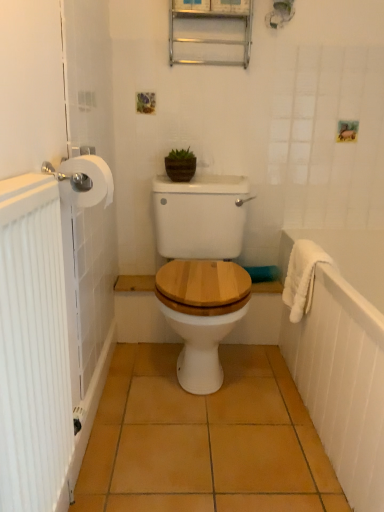
What do you see at coordinates (180, 165) in the screenshot? The image size is (384, 512). I see `green matte pot at center` at bounding box center [180, 165].

The image size is (384, 512). What do you see at coordinates (33, 347) in the screenshot?
I see `white ribbed radiator at left` at bounding box center [33, 347].

Describe the element at coordinates (302, 277) in the screenshot. I see `white fluffy bath towel at right` at that location.

In order to face white matte toilet paper at left, should I rotate leftwards or rightwards?

Turn left approximately 14.302 degrees to face it.

What are the coordinates of `orange ceramic tile at center` in the screenshot? It's located at click(204, 439).

In order to click on metallic silver medicine cabinet at upper center in this screenshot , I will do pyautogui.click(x=211, y=19).

From the image's perspective, would you say white fluffy bath towel at right is positioned over green matte pot at center?

No, from the image's perspective, white fluffy bath towel at right is not over green matte pot at center.

Does white fluffy bath towel at right have a greater height compared to green matte pot at center?

Yes.

Considering the relative positions of white fluffy bath towel at right and green matte pot at center in the image provided, is white fluffy bath towel at right to the right of green matte pot at center from the viewer's perspective?

Indeed, white fluffy bath towel at right is positioned on the right side of green matte pot at center.

How different are the orientations of white fluffy bath towel at right and green matte pot at center in degrees?

They differ by 87.3 degrees in their facing directions.

Which object is closer to the camera taking this photo, white matte toilet paper at left or orange ceramic tile at center?

white matte toilet paper at left.

From the picture: From a real-world perspective, is white matte toilet paper at left located beneath orange ceramic tile at center?

No, from a real-world perspective, white matte toilet paper at left is not under orange ceramic tile at center.

Measure the distance from white matte toilet paper at left to orange ceramic tile at center.

They are 35.41 inches apart.

Are white matte toilet paper at left and orange ceramic tile at center beside each other?

No, white matte toilet paper at left is not making contact with orange ceramic tile at center.

Considering the relative positions of white fluffy bath towel at right and white ribbed radiator at left in the image provided, is white fluffy bath towel at right to the left of white ribbed radiator at left from the viewer's perspective?

Incorrect, white fluffy bath towel at right is not on the left side of white ribbed radiator at left.

Looking at this image, is white ribbed radiator at left a part of white fluffy bath towel at right?

That's incorrect, white ribbed radiator at left is not inside white fluffy bath towel at right.

Can you confirm if white fluffy bath towel at right is bigger than white ribbed radiator at left?

Incorrect, white fluffy bath towel at right is not larger than white ribbed radiator at left.

Would you say orange ceramic tile at center contains metallic silver medicine cabinet at upper center?

No, metallic silver medicine cabinet at upper center is not surrounded by orange ceramic tile at center.

Is orange ceramic tile at center facing away from metallic silver medicine cabinet at upper center?

No.

Considering the positions of objects orange ceramic tile at center and metallic silver medicine cabinet at upper center in the image provided, who is more to the right, orange ceramic tile at center or metallic silver medicine cabinet at upper center?

metallic silver medicine cabinet at upper center.

Is metallic silver medicine cabinet at upper center facing towards orange ceramic tile at center?

No, metallic silver medicine cabinet at upper center is not aimed at orange ceramic tile at center.

Looking at this image, from a real-world perspective, who is located lower, metallic silver medicine cabinet at upper center or orange ceramic tile at center?

orange ceramic tile at center.

Where is `ceramic tile in front of the metallic silver medicine cabinet at upper center`? The image size is (384, 512). ceramic tile in front of the metallic silver medicine cabinet at upper center is located at coordinates (204, 439).

Looking at this image, looking at the image, does metallic silver medicine cabinet at upper center seem bigger or smaller compared to orange ceramic tile at center?

metallic silver medicine cabinet at upper center is smaller than orange ceramic tile at center.

In the scene shown: Is the position of white textured towel at right less distant than that of metallic silver medicine cabinet at upper center?

Yes, white textured towel at right is closer to the viewer.

Which object is thinner, white textured towel at right or metallic silver medicine cabinet at upper center?

metallic silver medicine cabinet at upper center is thinner.

Is point (323, 369) closer to viewer compared to point (220, 39)?

Yes.

Which of these two, orange ceramic tile at center or white matte toilet paper at left, stands taller?

Standing taller between the two is white matte toilet paper at left.

This screenshot has height=512, width=384. In the image, there is a white matte toilet paper at left. In order to click on ceramic tile below it (from a real-world perspective) in this screenshot , I will do `click(204, 439)`.

Is orange ceramic tile at center spatially inside white matte toilet paper at left, or outside of it?

orange ceramic tile at center cannot be found inside white matte toilet paper at left.

Find the location of a particular element. This screenshot has height=512, width=384. bath towel that is on the right side of green matte pot at center is located at coordinates (302, 277).

In the image, there is a white matte toilet paper at left. Where is `ceramic tile below it (from a real-world perspective)`? This screenshot has height=512, width=384. ceramic tile below it (from a real-world perspective) is located at coordinates (204, 439).

Consider the image. Which object lies further to the anchor point green matte pot at center, metallic silver medicine cabinet at upper center or white ribbed radiator at left?

white ribbed radiator at left is further to green matte pot at center.

Based on their spatial positions, is orange ceramic tile at center or green matte pot at center closer to white textured towel at right?

orange ceramic tile at center is closer to white textured towel at right.

Estimate the real-world distances between objects in this image. Which object is further from white textured towel at right, orange ceramic tile at center or white fluffy bath towel at right?

orange ceramic tile at center.

Which object lies nearer to the anchor point green matte pot at center, metallic silver medicine cabinet at upper center or white fluffy bath towel at right?

Based on the image, metallic silver medicine cabinet at upper center appears to be nearer to green matte pot at center.

Estimate the real-world distances between objects in this image. Which object is closer to green matte pot at center, metallic silver medicine cabinet at upper center or white textured towel at right?

The object closer to green matte pot at center is metallic silver medicine cabinet at upper center.

Estimate the real-world distances between objects in this image. Which object is further from metallic silver medicine cabinet at upper center, white fluffy bath towel at right or white matte toilet paper at left?

white matte toilet paper at left lies further to metallic silver medicine cabinet at upper center than the other object.

Estimate the real-world distances between objects in this image. Which object is further from white matte toilet paper at left, green matte pot at center or orange ceramic tile at center?

orange ceramic tile at center lies further to white matte toilet paper at left than the other object.

Looking at this image, from the image, which object appears to be farther from metallic silver medicine cabinet at upper center, green matte pot at center or white ribbed radiator at left?

white ribbed radiator at left.

At what (x,y) coordinates should I click in order to perform the action: click on toilet paper that lies between metallic silver medicine cabinet at upper center and orange ceramic tile at center from top to bottom. Please return your answer as a coordinate pair (x, y). The height and width of the screenshot is (512, 384). Looking at the image, I should click on (90, 178).

At what (x,y) coordinates should I click in order to perform the action: click on medicine cabinet located between white matte toilet paper at left and green matte pot at center in the depth direction. Please return your answer as a coordinate pair (x, y). The height and width of the screenshot is (512, 384). Looking at the image, I should click on (211, 19).

Find the location of a particular element. bath towel between white matte toilet paper at left and green matte pot at center in the front-back direction is located at coordinates (302, 277).

In order to click on bath that lies between metallic silver medicine cabinet at upper center and orange ceramic tile at center from top to bottom in this screenshot , I will do `click(343, 357)`.